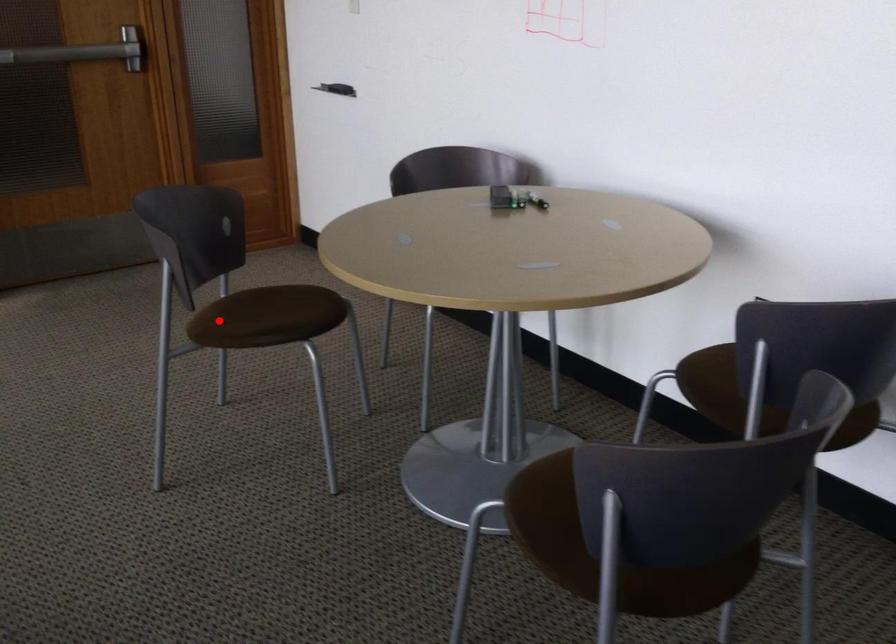
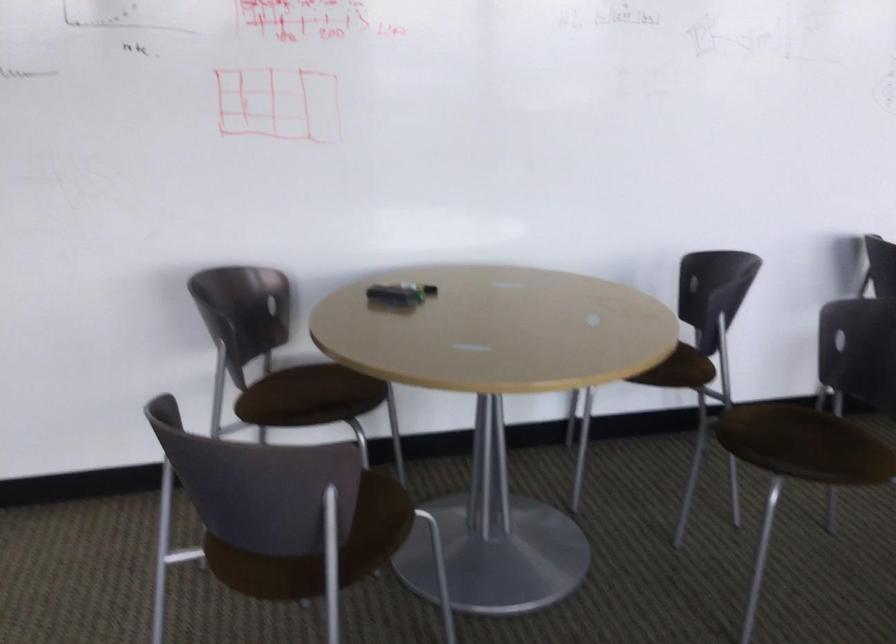
Question: I am providing you with two images of the same scene from different viewpoints. In image1, a red point is highlighted. Considering the same 3D point in image2, which of the following is correct?

Choices:
 (A) It is closer
 (B) It is farther

Answer: (A)